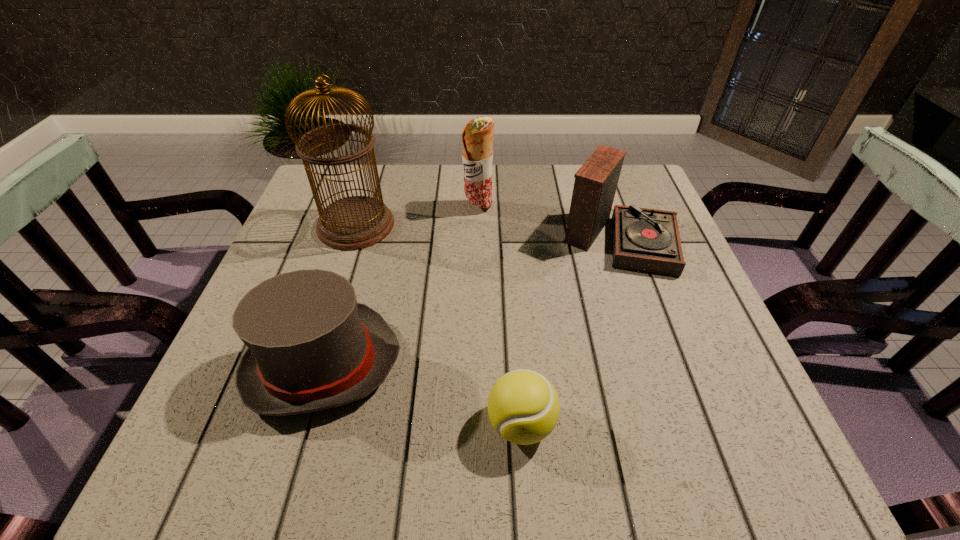
I want to click on object at the far right corner, so click(647, 240).

I want to click on vacant space at the far edge of the desktop, so click(x=443, y=168).

You are a GUI agent. You are given a task and a screenshot of the screen. Output one action in this format:
    pyautogui.click(x=<x>, y=<y>)
    Task: Click on the free spot at the near edge of the desktop
    
    Given the screenshot: What is the action you would take?
    pyautogui.click(x=499, y=451)

Where is `free region at the left edge of the desktop`? This screenshot has height=540, width=960. free region at the left edge of the desktop is located at coordinates (301, 267).

Where is `free space at the right edge`? free space at the right edge is located at coordinates (722, 350).

The width and height of the screenshot is (960, 540). What are the coordinates of `vacant space at the far left corner of the desktop` in the screenshot? It's located at (300, 204).

Where is `vacant area at the near right corner`? vacant area at the near right corner is located at coordinates (735, 424).

This screenshot has height=540, width=960. In order to click on vacant point located between the shortest object and the burrito in this screenshot , I will do `click(499, 315)`.

You are a GUI agent. You are given a task and a screenshot of the screen. Output one action in this format:
    pyautogui.click(x=<x>, y=<y>)
    Task: Click on the blank region between the phonograph record and the burrito
    
    Given the screenshot: What is the action you would take?
    pyautogui.click(x=549, y=222)

At what (x,y) coordinates should I click in order to perform the action: click on free space between the rightmost object and the second tallest object. Please return your answer as a coordinate pair (x, y). Image resolution: width=960 pixels, height=540 pixels. Looking at the image, I should click on (549, 222).